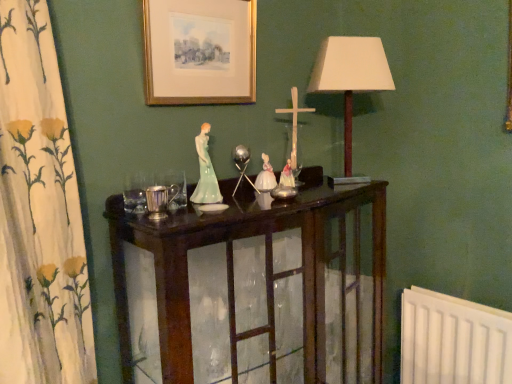
Question: Is dark wood cabinet at center taller or shorter than white fabric lampshade at upper right?

Choices:
 (A) tall
 (B) short

Answer: (A)

Question: Is dark wood cabinet at center inside the boundaries of white fabric lampshade at upper right, or outside?

Choices:
 (A) inside
 (B) outside

Answer: (B)

Question: Considering the real-world distances, which object is farthest from the silver metallic candle holder at center?

Choices:
 (A) dark wood cabinet at center
 (B) gold-framed print at upper center
 (C) white fabric lampshade at upper right

Answer: (C)

Question: Which of these objects is positioned closest to the white fabric lampshade at upper right?

Choices:
 (A) silver metallic candle holder at center
 (B) gold-framed print at upper center
 (C) dark wood cabinet at center

Answer: (B)